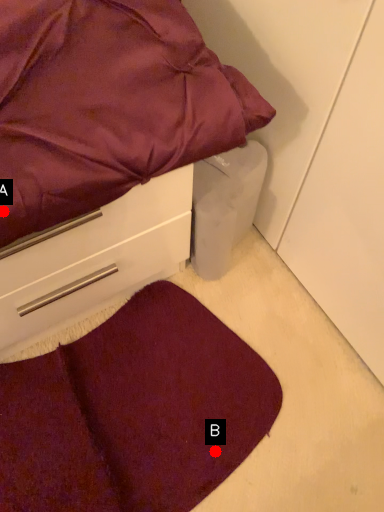
Question: Two points are circled on the image, labeled by A and B beside each circle. Which of the following is the closest to the observer?

Choices:
 (A) A is closer
 (B) B is closer

Answer: (A)